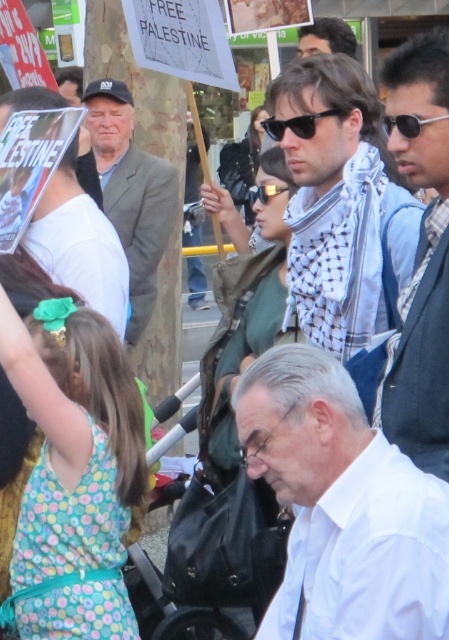
Question: Which point is closer to the camera?

Choices:
 (A) (268, 184)
 (B) (427, 368)
 (C) (414, 132)
 (D) (368, 337)

Answer: (B)

Question: Where is gray woolen suit at center located in relation to black plastic sunglasses at upper center in the image?

Choices:
 (A) left
 (B) right

Answer: (A)

Question: Among these points, which one is farthest from the camera?

Choices:
 (A) (418, 72)
 (B) (315, 131)
 (C) (412, 138)

Answer: (B)

Question: Which object is positioned closest to the gray woolen suit at center?

Choices:
 (A) white checkered scarf at center
 (B) white shirt at center
 (C) black plastic sunglasses at upper center
 (D) dark gray fabric vest at upper right

Answer: (A)

Question: Is dark gray fabric vest at upper right below gray woolen suit at center?

Choices:
 (A) no
 (B) yes

Answer: (B)

Question: Is gray woolen suit at center thinner than black plastic sunglasses at center?

Choices:
 (A) no
 (B) yes

Answer: (A)